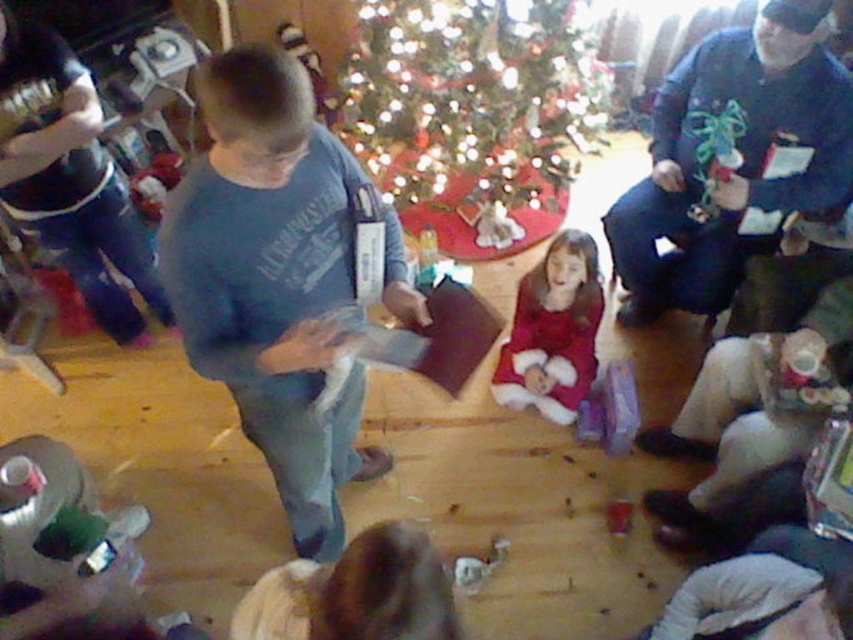
Who is more forward, (312,291) or (534,33)?

Positioned in front is point (312,291).

Where is `blue cotton shirt at center`? This screenshot has height=640, width=853. blue cotton shirt at center is located at coordinates (271, 280).

Image resolution: width=853 pixels, height=640 pixels. Describe the element at coordinates (271, 280) in the screenshot. I see `blue cotton shirt at center` at that location.

The image size is (853, 640). Describe the element at coordinates (271, 280) in the screenshot. I see `blue cotton shirt at center` at that location.

Where is `blue cotton shirt at center`? blue cotton shirt at center is located at coordinates (271, 280).

Between blue fleece sweater at center and velvet red dress at center, which one is positioned higher?

Positioned higher is blue fleece sweater at center.

Is blue fleece sweater at center further to camera compared to velvet red dress at center?

No.

Where is `blue fleece sweater at center`? Image resolution: width=853 pixels, height=640 pixels. blue fleece sweater at center is located at coordinates (733, 148).

Where is `blue fleece sweater at center`? The width and height of the screenshot is (853, 640). blue fleece sweater at center is located at coordinates (733, 148).